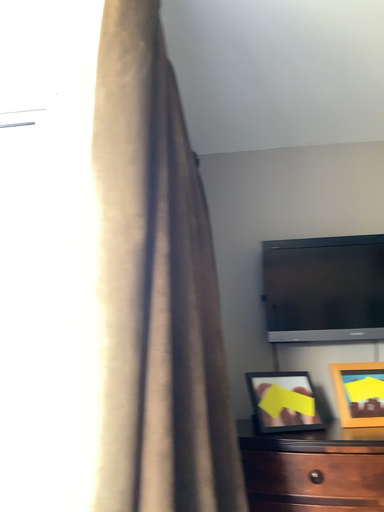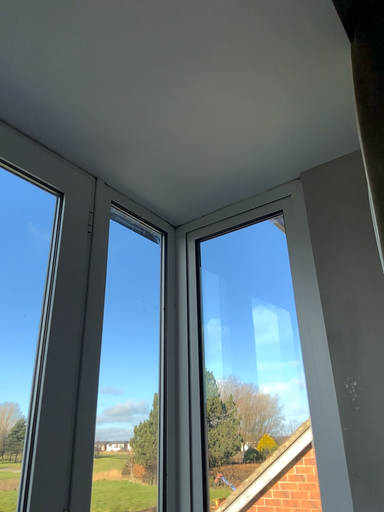
Question: How did the camera likely rotate when shooting the video?

Choices:
 (A) rotated upward
 (B) rotated downward

Answer: (A)